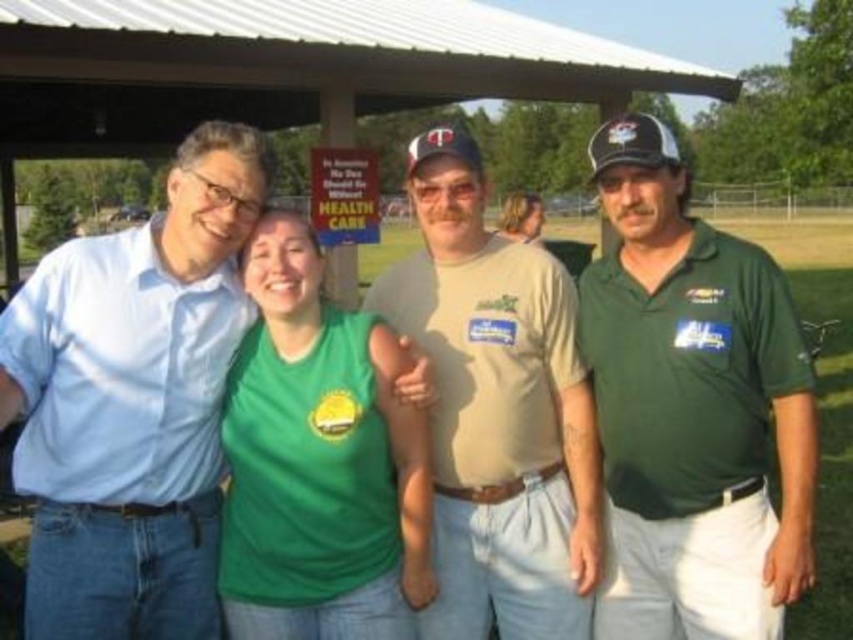
You are standing at the point labeled point (80, 424) and want to walk towards the pavilion behind the group. However, there is an obstacle at point (521, 547). Will you pass in front of or behind the obstacle?

Since point (80, 424) is in front of point (521, 547), you will pass in front of the obstacle at point (521, 547) when walking towards the pavilion.